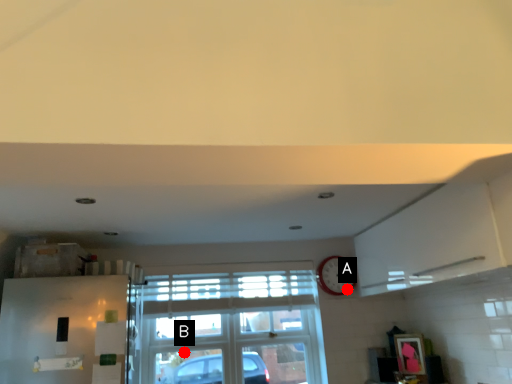
Question: Two points are circled on the image, labeled by A and B beside each circle. Which point is closer to the camera?

Choices:
 (A) A is closer
 (B) B is closer

Answer: (B)